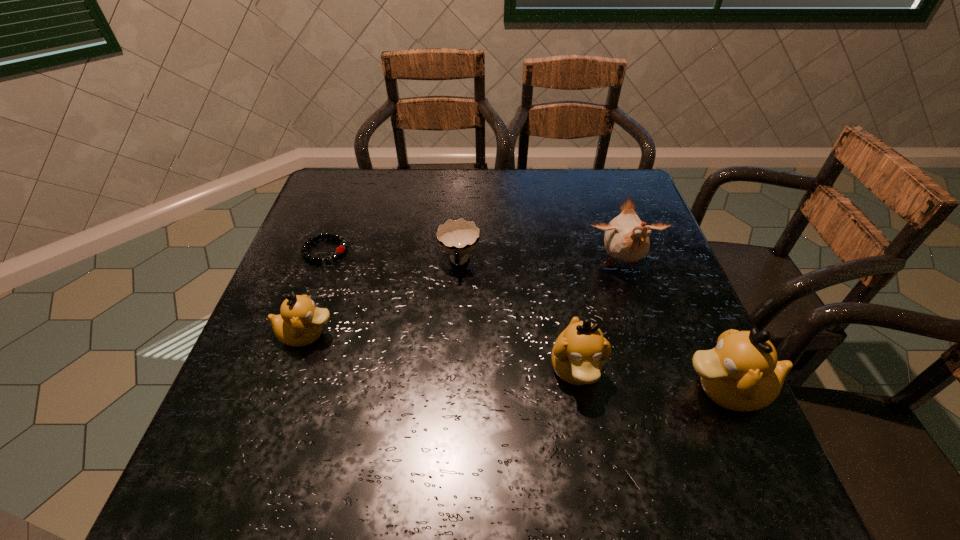
Where is `the third shortest object`? Image resolution: width=960 pixels, height=540 pixels. the third shortest object is located at coordinates (300, 322).

You are a GUI agent. You are given a task and a screenshot of the screen. Output one action in this format:
    pyautogui.click(x=<x>, y=<y>)
    Task: Click on the shortest duckling
    The width and height of the screenshot is (960, 540).
    Given the screenshot: What is the action you would take?
    pyautogui.click(x=300, y=322)

Locate an element on the screen. This screenshot has height=540, width=960. the second duckling from right to left is located at coordinates (578, 353).

I want to click on the third tallest object, so click(x=578, y=353).

Identify the location of the rightmost duckling. (741, 373).

The image size is (960, 540). I want to click on cup, so click(459, 237).

Image resolution: width=960 pixels, height=540 pixels. Identify the location of the second shortest object. (459, 237).

This screenshot has height=540, width=960. In order to click on bird in this screenshot , I will do `click(626, 238)`.

Locate an element on the screen. This screenshot has height=540, width=960. the shortest object is located at coordinates (340, 250).

Locate an element on the screen. The height and width of the screenshot is (540, 960). vacant space located on the face of the leftmost duckling is located at coordinates (501, 335).